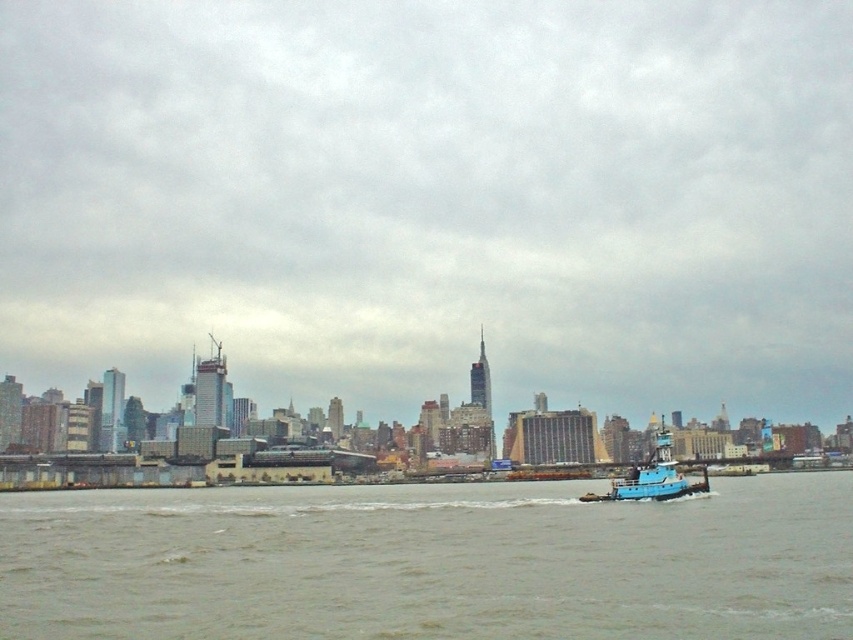
You are a photographer planning to take a picture of the gray concrete river at lower center and the blue matte tugboat at lower right. Based on their positions, which object should appear closer to the bottom edge of your photo?

The gray concrete river at lower center is positioned under the blue matte tugboat at lower right, so in the photo, the gray concrete river at lower center will appear closer to the bottom edge.

You are an architect designing a new observation deck on the waterfront. You want to ensure that the deck has an unobstructed view of the matte gray sky at center and the blue matte tugboat at lower right. Based on the scene, which object will appear higher in the sky from the deck?

The matte gray sky at center appears higher in the sky than the blue matte tugboat at lower right because it is taller according to the description.

You are standing on a pier overlooking the city skyline. You notice the matte gray sky at center and the gray concrete river at lower center. How far apart are these two landmarks from your viewpoint?

The matte gray sky at center is 142.70 meters away from the gray concrete river at lower center.